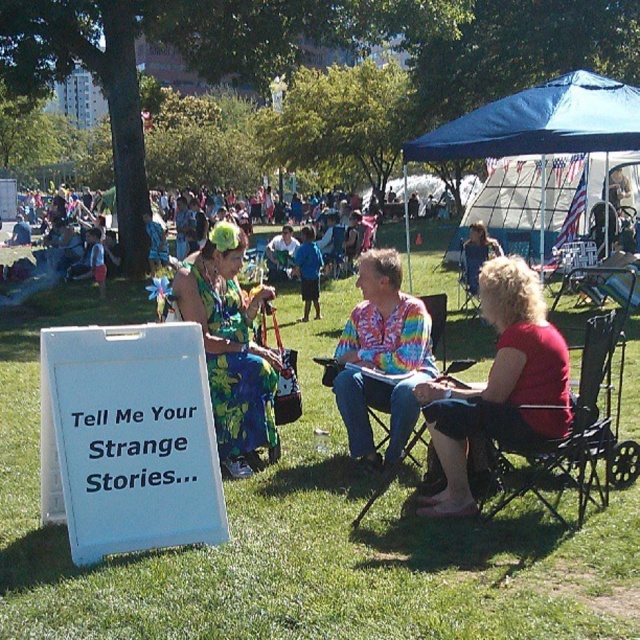
Question: Which object is closer to the camera taking this photo?

Choices:
 (A) metallic folding chair at lower right
 (B) blue tie-dye shirt at center
 (C) white paper sign at lower left
 (D) red cotton shirt at center

Answer: (C)

Question: Is green grass at lower center to the left of tie-dye fabric shirt at center from the viewer's perspective?

Choices:
 (A) yes
 (B) no

Answer: (B)

Question: Can you confirm if red cotton shirt at center is wider than blue fabric canopy at upper center?

Choices:
 (A) no
 (B) yes

Answer: (A)

Question: Among these objects, which one is nearest to the camera?

Choices:
 (A) tie-dye fabric shirt at center
 (B) red cotton shirt at center
 (C) blue fabric canopy at upper center
 (D) metallic folding chair at lower right

Answer: (D)

Question: Is floral fabric dress at center bigger than tie-dye fabric shirt at center?

Choices:
 (A) no
 (B) yes

Answer: (A)

Question: Considering the real-world distances, which object is farthest from the red cotton shirt at center?

Choices:
 (A) blue tie-dye shirt at center
 (B) green grass at lower center

Answer: (A)